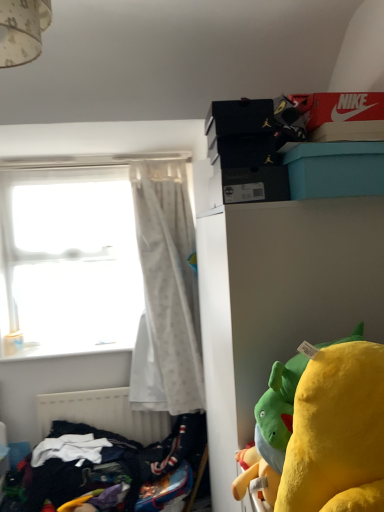
Measure the distance between white matte radiator at lower left and camera.

They are 7.84 feet apart.

I want to click on white matte cabinet at upper right, so click(x=278, y=302).

Considering the positions of objects teal plastic box at upper right and white matte cabinet at upper right in the image provided, who is behind, teal plastic box at upper right or white matte cabinet at upper right?

white matte cabinet at upper right is more distant.

Is teal plastic box at upper right at the right side of white matte cabinet at upper right?

Correct, you'll find teal plastic box at upper right to the right of white matte cabinet at upper right.

Locate an element on the screen. cabinetry below the teal plastic box at upper right (from the image's perspective) is located at coordinates (278, 302).

From a real-world perspective, is teal plastic box at upper right positioned under white matte cabinet at upper right based on gravity?

No, from a real-world perspective, teal plastic box at upper right is not below white matte cabinet at upper right.

From the image's perspective, is white matte cabinet at upper right located above white matte radiator at lower left?

Yes, from the image's perspective, white matte cabinet at upper right is over white matte radiator at lower left.

From a real-world perspective, is white matte cabinet at upper right positioned over white matte radiator at lower left based on gravity?

Correct, in the physical world, white matte cabinet at upper right is higher than white matte radiator at lower left.

Would you say white matte cabinet at upper right is inside or outside white matte radiator at lower left?

white matte cabinet at upper right exists outside the volume of white matte radiator at lower left.

Is white matte cabinet at upper right touching white matte radiator at lower left?

white matte cabinet at upper right and white matte radiator at lower left are not in contact.

In the image, is dark blue fabric at lower left on the left side or the right side of white matte cabinet at upper right?

dark blue fabric at lower left is positioned on white matte cabinet at upper right's left side.

Is dark blue fabric at lower left far away from white matte cabinet at upper right?

No, dark blue fabric at lower left is not far away from white matte cabinet at upper right.

Locate an element on the screen. Image resolution: width=384 pixels, height=512 pixels. cabinetry on the right of dark blue fabric at lower left is located at coordinates (278, 302).

Is dark blue fabric at lower left facing away from white matte cabinet at upper right?

dark blue fabric at lower left is not turned away from white matte cabinet at upper right.

Which is in front, point (98, 241) or point (256, 320)?

The point (256, 320) is closer to the camera.

How far apart are transparent glass window at left and white matte cabinet at upper right?

They are 1.19 meters apart.

Could you tell me if transparent glass window at left is turned towards white matte cabinet at upper right?

Yes, transparent glass window at left is aimed at white matte cabinet at upper right.

Image resolution: width=384 pixels, height=512 pixels. Find the location of `radiator to the left of white sheer curtain at left`. radiator to the left of white sheer curtain at left is located at coordinates (103, 414).

From the image's perspective, does white matte radiator at lower left appear lower than white sheer curtain at left?

Yes, from the image's perspective, white matte radiator at lower left is below white sheer curtain at left.

Consider the image. Measure the distance between white matte radiator at lower left and white sheer curtain at left.

white matte radiator at lower left and white sheer curtain at left are 17.65 inches apart.

Would you say white matte radiator at lower left is inside or outside white sheer curtain at left?

white matte radiator at lower left is located beyond the bounds of white sheer curtain at left.

From the image's perspective, is transparent glass window at left above or below white sheer curtain at left?

Clearly, from the image's perspective, transparent glass window at left is above white sheer curtain at left.

Does transparent glass window at left have a greater height compared to white sheer curtain at left?

In fact, transparent glass window at left may be shorter than white sheer curtain at left.

The image size is (384, 512). Identify the location of curtain to the right of transparent glass window at left. (166, 294).

Which is farther from the camera, (145, 215) or (109, 420)?

The point (145, 215) is farther.

Is white sheer curtain at left wider than white matte radiator at lower left?

Indeed, white sheer curtain at left has a greater width compared to white matte radiator at lower left.

Find the location of a particular element. curtain in front of the white matte radiator at lower left is located at coordinates (166, 294).

Which of these two, white sheer curtain at left or white matte radiator at lower left, stands taller?

white sheer curtain at left.

Identify the location of cabinetry below the teal plastic box at upper right (from a real-world perspective). (278, 302).

Image resolution: width=384 pixels, height=512 pixels. I want to click on cabinetry positioned vertically above the white matte radiator at lower left (from a real-world perspective), so click(x=278, y=302).

When comparing their distances from white matte radiator at lower left, does teal plastic box at upper right or white sheer curtain at left seem closer?

white sheer curtain at left is closer to white matte radiator at lower left.

Which object lies nearer to the anchor point white sheer curtain at left, dark blue fabric at lower left or teal plastic box at upper right?

Based on the image, dark blue fabric at lower left appears to be nearer to white sheer curtain at left.

In the scene shown: When comparing their distances from white sheer curtain at left, does teal plastic box at upper right or white matte radiator at lower left seem further?

teal plastic box at upper right is positioned further to the anchor white sheer curtain at left.

Looking at this image, from the image, which object appears to be nearer to white matte radiator at lower left, white matte cabinet at upper right or dark blue fabric at lower left?

dark blue fabric at lower left is positioned closer to the anchor white matte radiator at lower left.

Estimate the real-world distances between objects in this image. Which object is further from dark blue fabric at lower left, white sheer curtain at left or transparent glass window at left?

transparent glass window at left is positioned further to the anchor dark blue fabric at lower left.

When comparing their distances from transparent glass window at left, does teal plastic box at upper right or dark blue fabric at lower left seem closer?

Based on the image, dark blue fabric at lower left appears to be nearer to transparent glass window at left.

Estimate the real-world distances between objects in this image. Which object is closer to dark blue fabric at lower left, transparent glass window at left or white sheer curtain at left?

white sheer curtain at left is closer to dark blue fabric at lower left.

When comparing their distances from white matte radiator at lower left, does white sheer curtain at left or teal plastic box at upper right seem further?

The object further to white matte radiator at lower left is teal plastic box at upper right.

Identify the location of radiator between teal plastic box at upper right and transparent glass window at left along the z-axis. point(103,414).

Identify the location of curtain between white matte cabinet at upper right and transparent glass window at left from front to back. Image resolution: width=384 pixels, height=512 pixels. (166, 294).

Identify the location of cabinetry between teal plastic box at upper right and dark blue fabric at lower left vertically. (278, 302).

What are the coordinates of `cabinetry between teal plastic box at upper right and transparent glass window at left from front to back` in the screenshot? It's located at (278, 302).